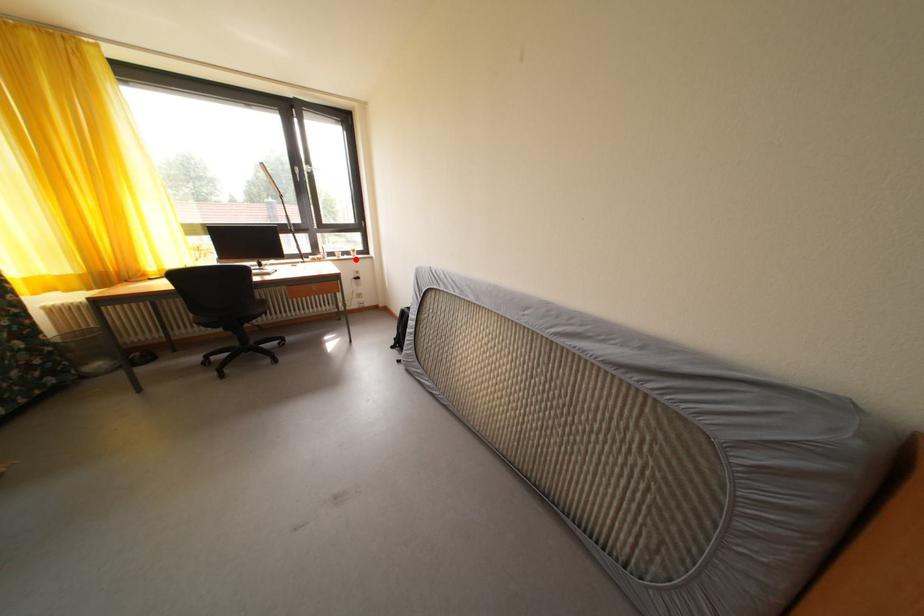
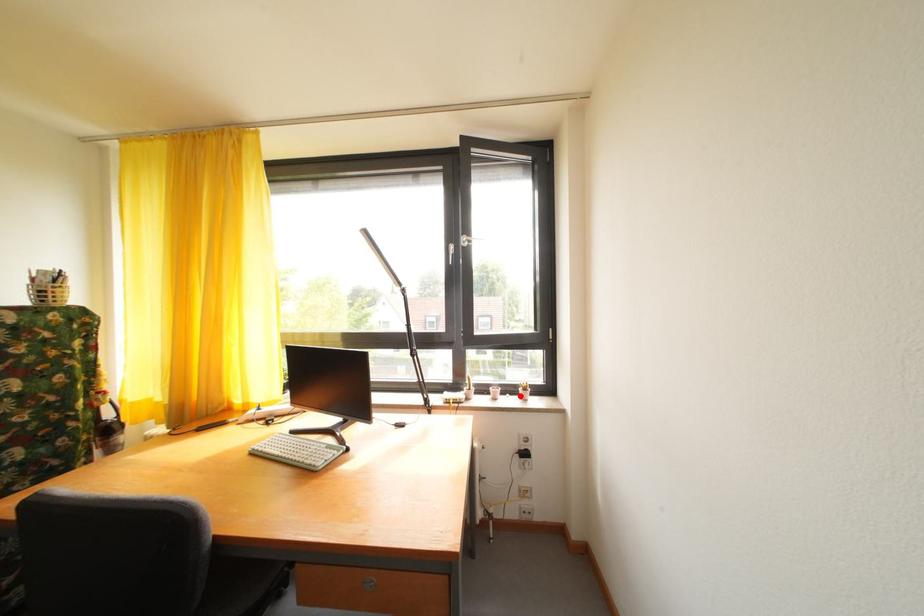
I am providing you with two images of the same scene from different viewpoints. A red point is marked on the first image and another point is marked on the second image. Is the marked point in image1 the same physical position as the marked point in image2?

Yes